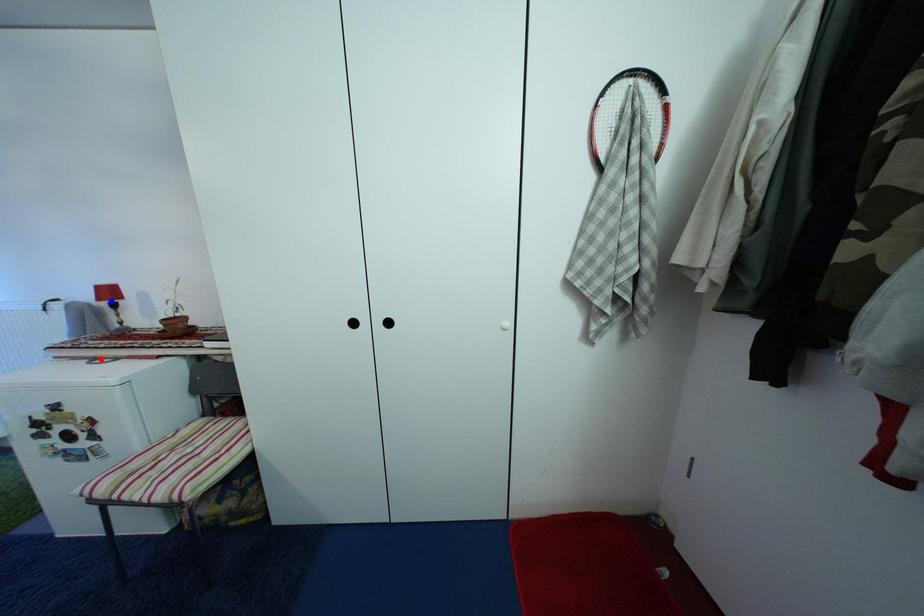
Question: Two points are marked on the image. Which point is closer to the camera?

Choices:
 (A) Blue point is closer.
 (B) Red point is closer.

Answer: (B)